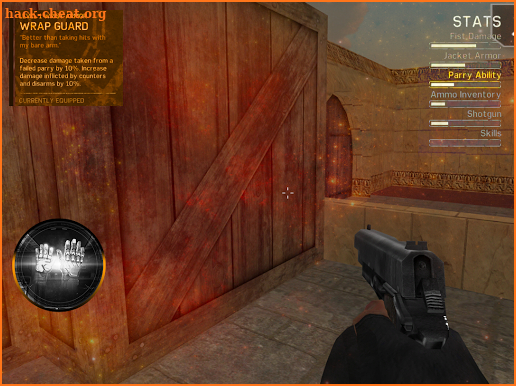
Find the location of a particular element. floor is located at coordinates (257, 338).